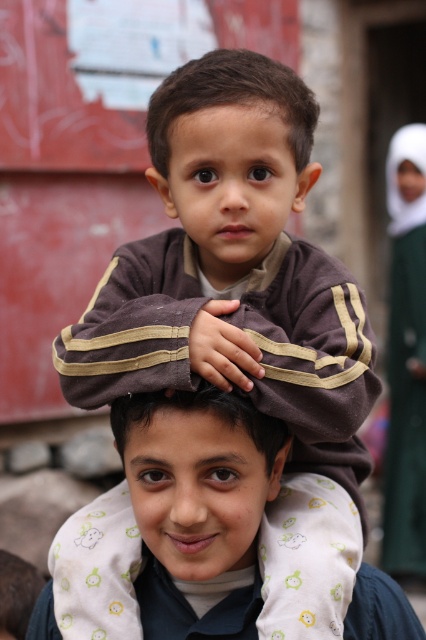
Is the position of brown soft fabric at center more distant than that of green fabric at upper right?

No, it is not.

Who is higher up, brown soft fabric at center or green fabric at upper right?

green fabric at upper right

Is point (368, 468) positioned before point (406, 381)?

Yes, it is in front of point (406, 381).

Find the location of a particular element. The width and height of the screenshot is (426, 640). brown soft fabric at center is located at coordinates (244, 316).

Is smooth brown hair at center thinner than green fabric at upper right?

Yes, smooth brown hair at center is thinner than green fabric at upper right.

Does smooth brown hair at center lie behind green fabric at upper right?

That is False.

Which is behind, point (219, 552) or point (416, 387)?

The point (416, 387) is behind.

Find the location of a particular element. smooth brown hair at center is located at coordinates (198, 476).

Is point (244, 179) closer to camera compared to point (157, 484)?

No, it is behind (157, 484).

Which is in front, point (273, 240) or point (256, 467)?

Point (256, 467) is more forward.

Is point (285, 134) farther from camera compared to point (203, 576)?

Yes, it is.

Find the location of a particular element. Image resolution: width=426 pixels, height=640 pixels. brown matte head at center is located at coordinates (232, 154).